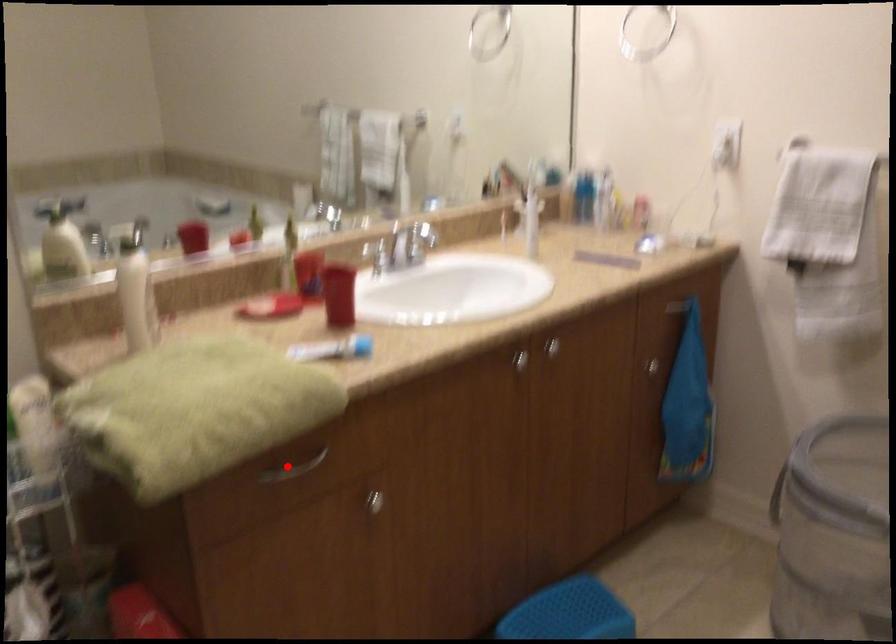
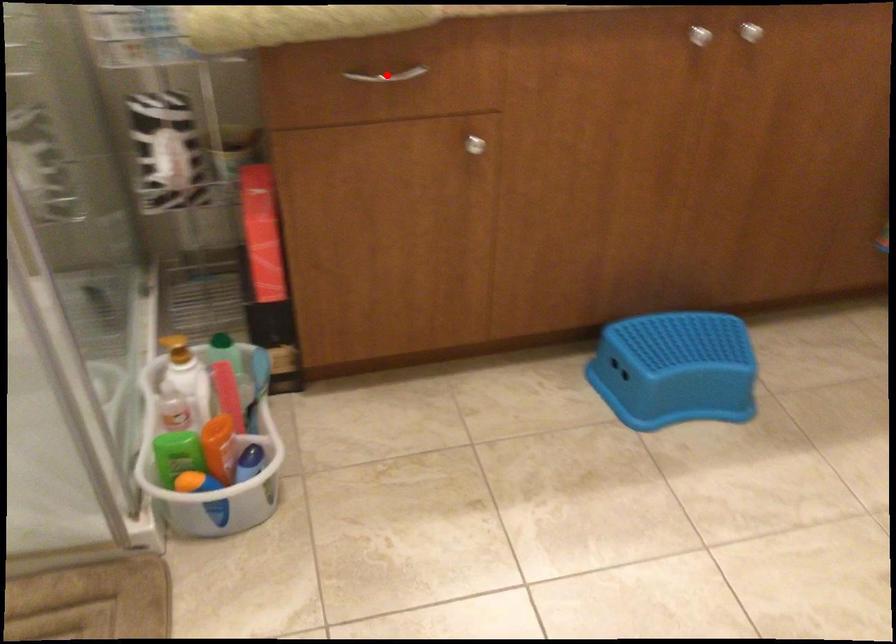
I am providing you with two images of the same scene from different viewpoints. A red point is marked on the first image and another point is marked on the second image. Do the highlighted points in image1 and image2 indicate the same real-world spot?

Yes